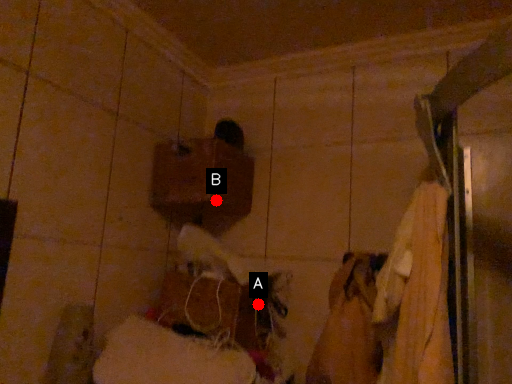
Question: Two points are circled on the image, labeled by A and B beside each circle. Which point appears farthest from the camera in this image?

Choices:
 (A) A is further
 (B) B is further

Answer: (A)